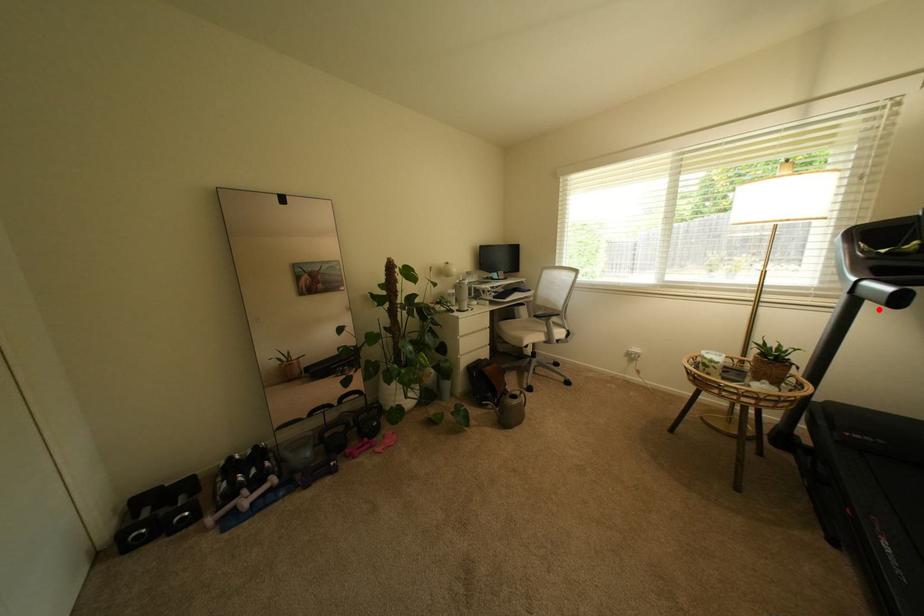
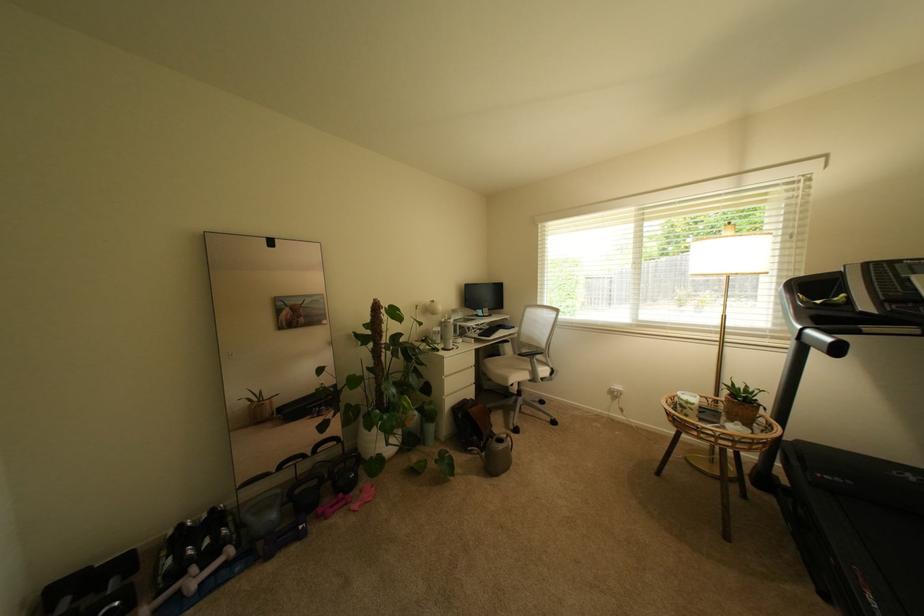
Find the pixel in the second image that matches the highlighted location in the first image.

(824, 355)